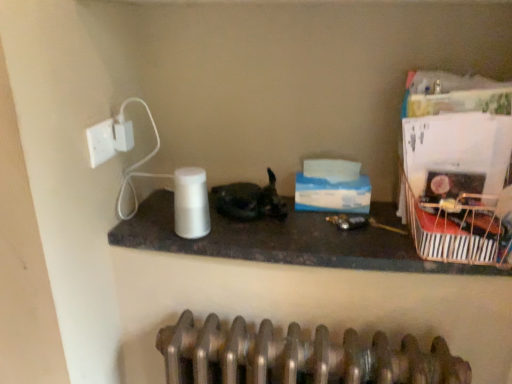
Locate an element on the screen. vacant space to the left of white matte paper towel at center is located at coordinates (150, 228).